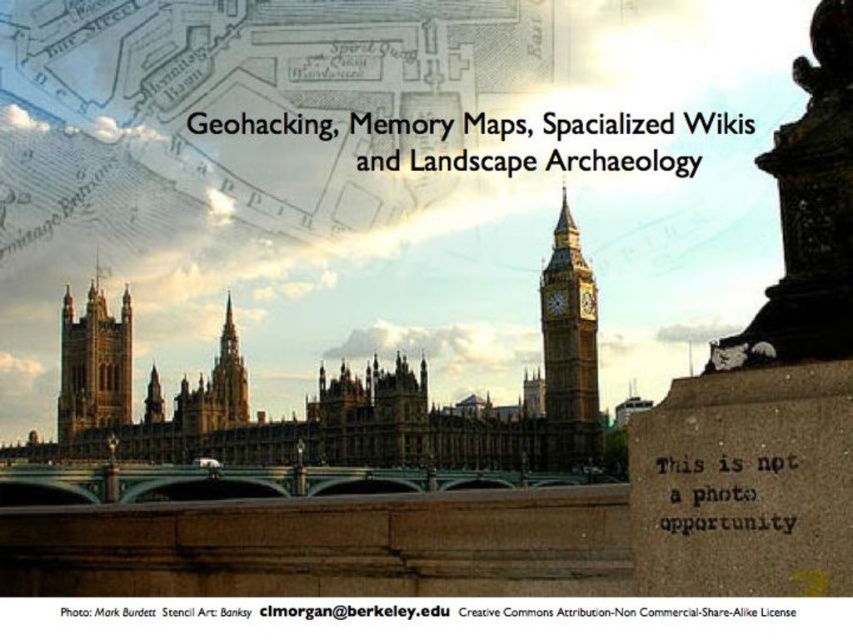
You are an architect reviewing a digital blueprint of the Palace of Westminster. You notice two elements in the design. The dark gray stone statue at upper right and the matte gold clock at center. Which of these two elements is positioned further to the east in the blueprint?

The dark gray stone statue at upper right is positioned to the right of the matte gold clock at center, so it is further to the east in the blueprint since it is on the right side of the clock.